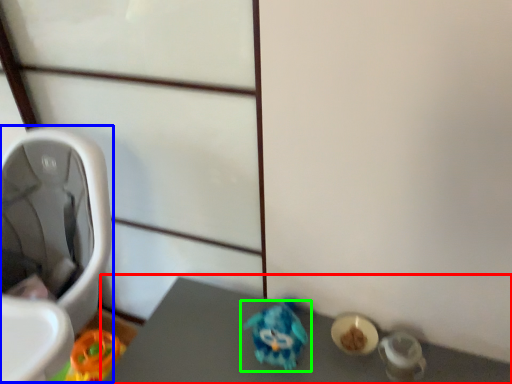
Question: Which object is positioned farthest from vanity (highlighted by a red box)? Select from baby carriage (highlighted by a blue box) and toy (highlighted by a green box).

Choices:
 (A) baby carriage
 (B) toy

Answer: (A)